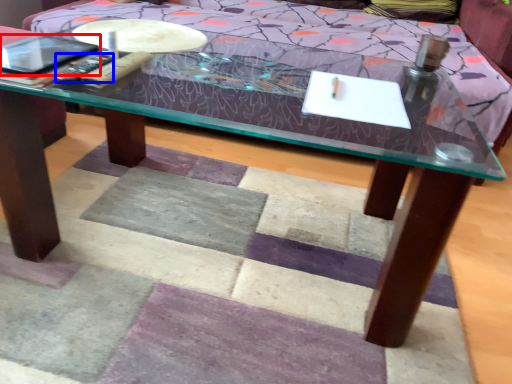
Question: Which point is closer to the camera, tablet computer (highlighted by a red box) or remote (highlighted by a blue box)?

Choices:
 (A) tablet computer
 (B) remote

Answer: (A)